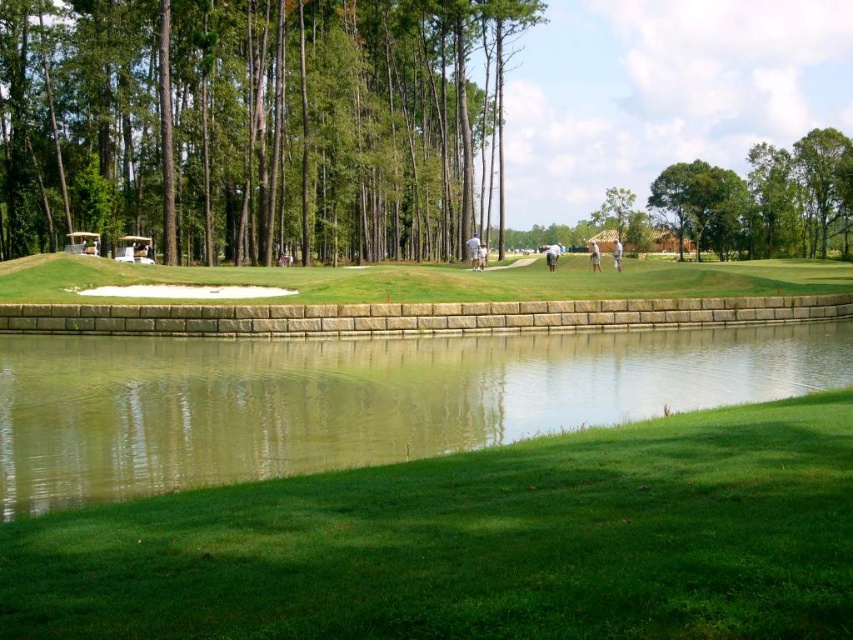
Based on the photo, is green leafy trees at upper left in front of green grassy golf course at center?

That is False.

You are a GUI agent. You are given a task and a screenshot of the screen. Output one action in this format:
    pyautogui.click(x=<x>, y=<y>)
    Task: Click on the green leafy trees at upper left
    The height and width of the screenshot is (640, 853).
    Given the screenshot: What is the action you would take?
    pyautogui.click(x=248, y=124)

Who is more forward, (68, 48) or (10, 285)?

Point (10, 285) is more forward.

At what (x,y) coordinates should I click in order to perform the action: click on green leafy trees at upper left. Please return your answer as a coordinate pair (x, y). This screenshot has height=640, width=853. Looking at the image, I should click on (248, 124).

Does green leafy tree at center appear under white cotton shirt at center?

No, green leafy tree at center is not below white cotton shirt at center.

Who is shorter, green leafy tree at center or white cotton shirt at center?

With less height is white cotton shirt at center.

Who is more distant from viewer, (612, 240) or (613, 250)?

The point (612, 240) is behind.

This screenshot has height=640, width=853. I want to click on green leafy tree at center, so click(x=613, y=212).

Who is taller, green grassy water at center or green grassy golf course at center?

Standing taller between the two is green grassy golf course at center.

Is green grassy water at center positioned behind green grassy golf course at center?

No, it is not.

Who is more forward, (659, 372) or (421, 300)?

Point (659, 372)

The image size is (853, 640). I want to click on green grassy water at center, so click(x=354, y=397).